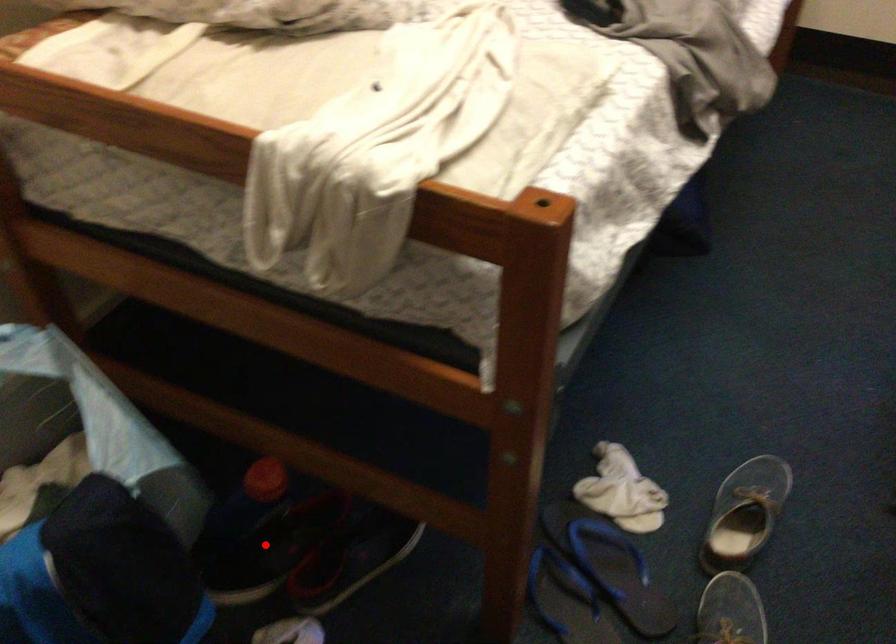
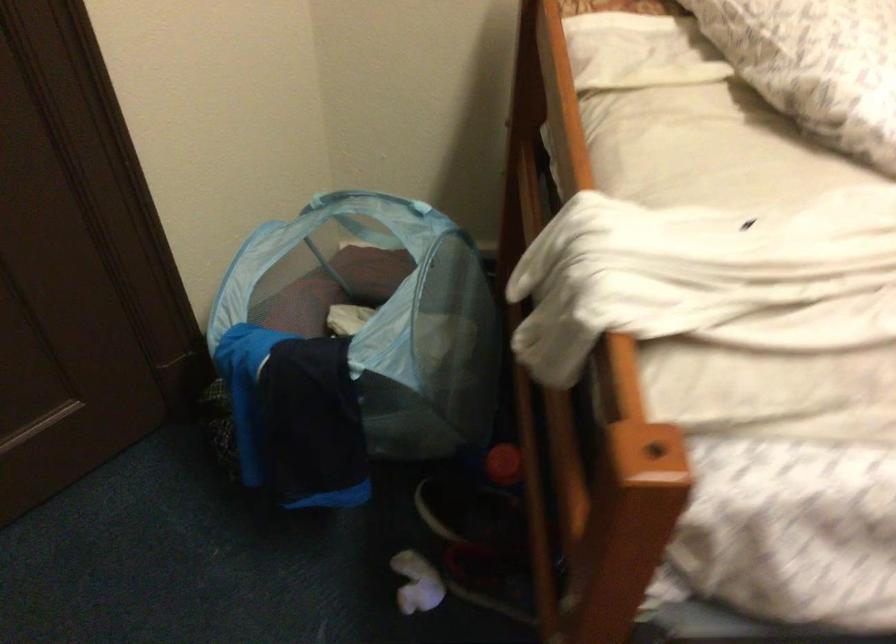
Find the pixel in the second image that matches the highlighted location in the first image.

(469, 509)